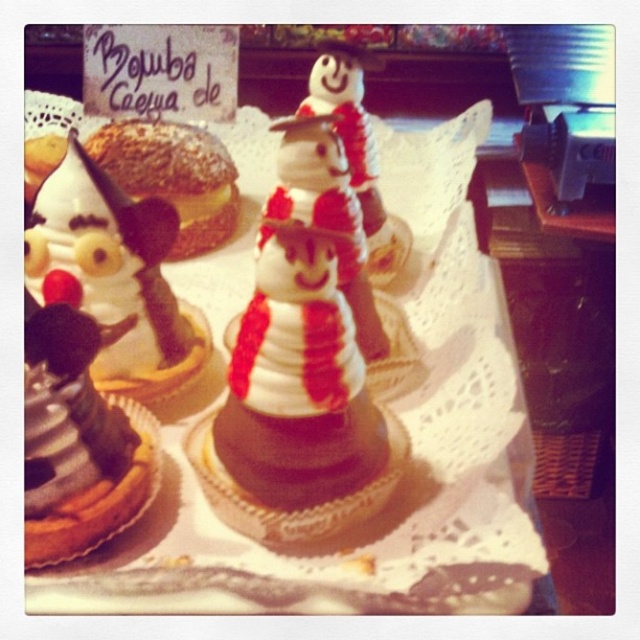
Can you confirm if white chocolate ice cream at left is smaller than white frosting snowman at center?

No.

Who is higher up, white chocolate ice cream at left or white frosting snowman at center?

Positioned higher is white frosting snowman at center.

You are a GUI agent. You are given a task and a screenshot of the screen. Output one action in this format:
    pyautogui.click(x=<x>, y=<y>)
    Task: Click on the white chocolate ice cream at left
    
    Given the screenshot: What is the action you would take?
    pyautogui.click(x=113, y=275)

At what (x,y) coordinates should I click in order to perform the action: click on white chocolate ice cream at left. Please return your answer as a coordinate pair (x, y). This screenshot has width=640, height=640. Looking at the image, I should click on (113, 275).

Is white chocolate snowman at center taller than white chocolate ice cream at left?

Indeed, white chocolate snowman at center has a greater height compared to white chocolate ice cream at left.

Which of these two, white chocolate snowman at center or white chocolate ice cream at left, stands taller?

With more height is white chocolate snowman at center.

Find the location of a particular element. white chocolate snowman at center is located at coordinates (298, 403).

Can you confirm if white lace doily at center is shorter than white frosting snowman at center?

Incorrect, white lace doily at center's height does not fall short of white frosting snowman at center's.

Can you confirm if white lace doily at center is positioned below white frosting snowman at center?

Actually, white lace doily at center is above white frosting snowman at center.

Identify the location of white lace doily at center. (376, 401).